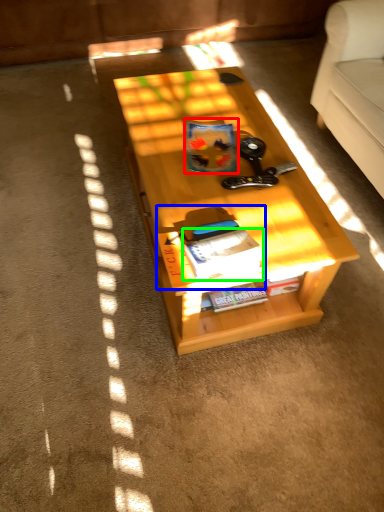
Question: Considering the real-world distances, which object is farthest from book (highlighted by a red box)? book (highlighted by a blue box) or magazine (highlighted by a green box)?

Choices:
 (A) book
 (B) magazine

Answer: (B)